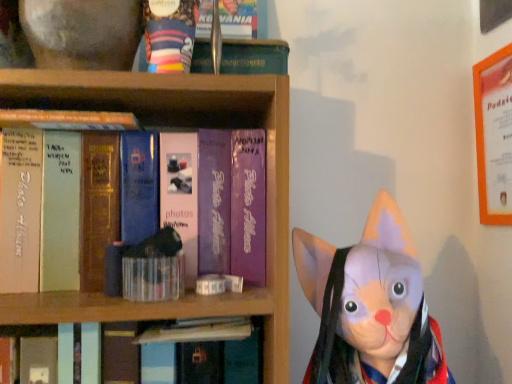
The height and width of the screenshot is (384, 512). What do you see at coordinates (67, 120) in the screenshot?
I see `matte blue book at upper left` at bounding box center [67, 120].

Locate an element on the screen. The width and height of the screenshot is (512, 384). matte blue book at upper left is located at coordinates (67, 120).

This screenshot has width=512, height=384. I want to click on matte blue book at upper left, so click(x=67, y=120).